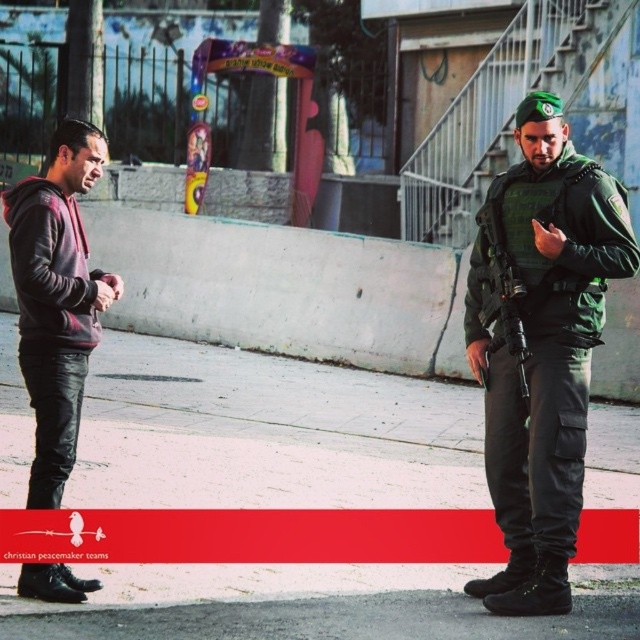
Question: Where is matte black hoodie at left located in relation to matte black rifle at right in the image?

Choices:
 (A) left
 (B) right

Answer: (A)

Question: Can you confirm if green matte uniform at right is positioned below matte black rifle at right?

Choices:
 (A) yes
 (B) no

Answer: (A)

Question: Which of the following is the closest to the observer?

Choices:
 (A) matte black hoodie at left
 (B) green matte uniform at right

Answer: (A)

Question: Does green matte uniform at right have a lesser width compared to matte black hoodie at left?

Choices:
 (A) no
 (B) yes

Answer: (A)

Question: Which of the following is the farthest from the observer?

Choices:
 (A) (515, 355)
 (B) (54, 156)

Answer: (A)

Question: Which is farther from the matte black rifle at right?

Choices:
 (A) green matte uniform at right
 (B) matte black hoodie at left

Answer: (B)